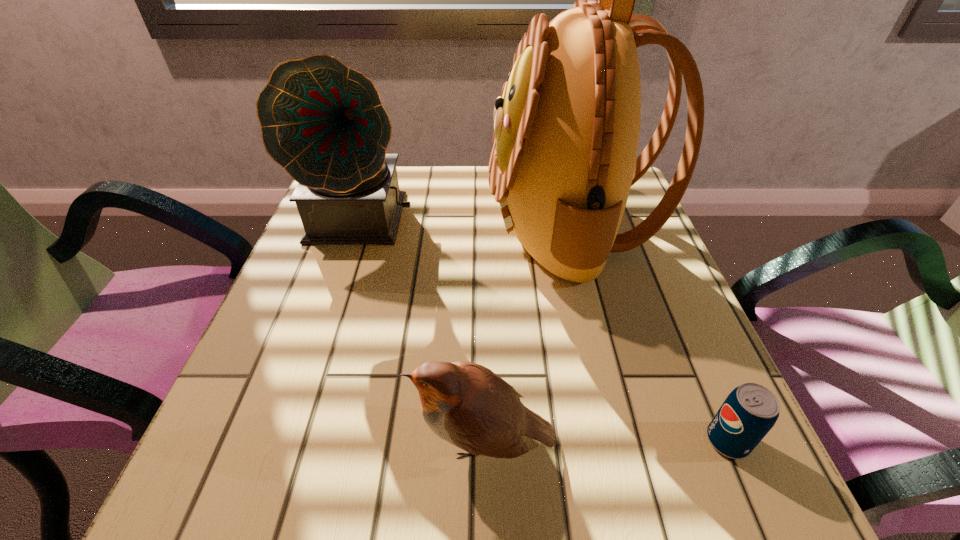
This screenshot has height=540, width=960. What are the coordinates of `vacant space located 0.270m at the face of the bird` in the screenshot? It's located at (221, 441).

The image size is (960, 540). Identify the location of vacant region located at the face of the bird. (235, 441).

Locate an element on the screen. The image size is (960, 540). blank space located 0.300m on the left of the pop is located at coordinates (493, 441).

You are a GUI agent. You are given a task and a screenshot of the screen. Output one action in this format:
    pyautogui.click(x=<x>, y=<y>)
    Task: Click on the backpack present at the far edge
    The width and height of the screenshot is (960, 540).
    Given the screenshot: What is the action you would take?
    pyautogui.click(x=566, y=130)

Image resolution: width=960 pixels, height=540 pixels. What are the coordinates of `record player that is at the far edge` in the screenshot? It's located at (323, 122).

Identify the location of bird at the near edge. The height and width of the screenshot is (540, 960). (466, 404).

Find the location of `pop that is positioned at the near edge`. pop that is positioned at the near edge is located at coordinates (749, 412).

Locate an element on the screen. The image size is (960, 540). object present at the left edge is located at coordinates (323, 122).

You are a GUI agent. You are given a task and a screenshot of the screen. Output one action in this format:
    pyautogui.click(x=<x>, y=<y>)
    Task: Click on the backpack that is at the right edge
    The height and width of the screenshot is (540, 960).
    Given the screenshot: What is the action you would take?
    pyautogui.click(x=566, y=130)

You are a GUI agent. You are given a task and a screenshot of the screen. Output one action in this format:
    pyautogui.click(x=<x>, y=<y>)
    Task: Click on the pop positioned at the right edge
    The height and width of the screenshot is (540, 960).
    Given the screenshot: What is the action you would take?
    pyautogui.click(x=749, y=412)